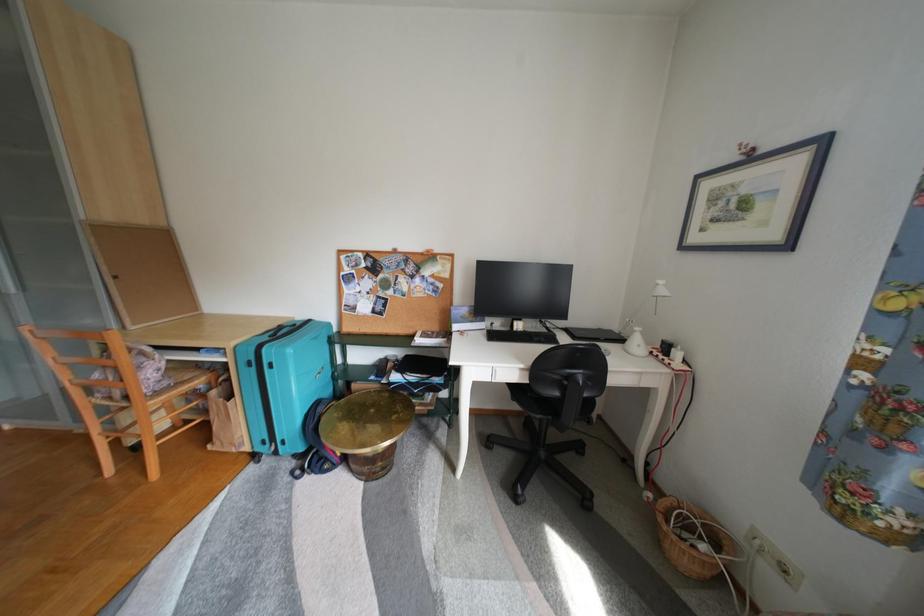
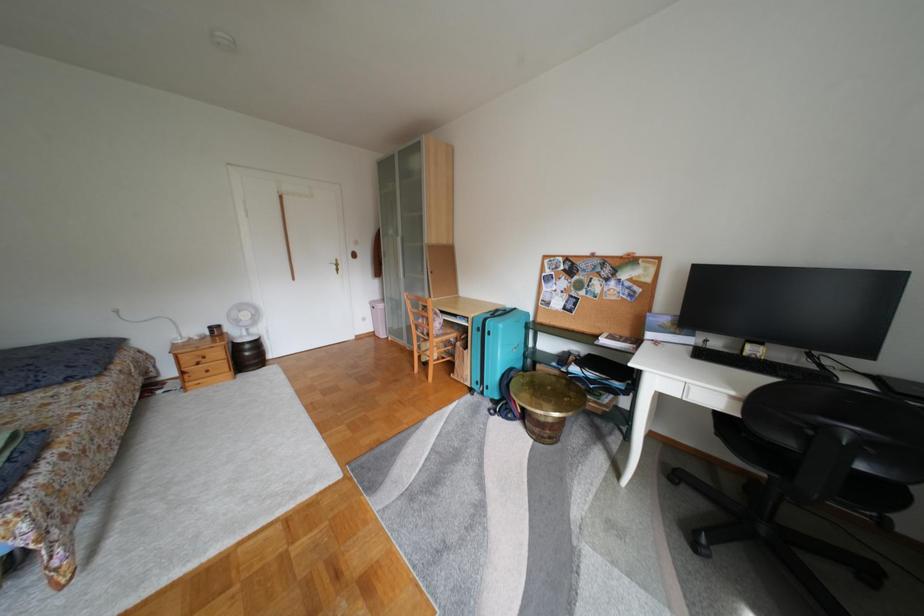
Question: The camera is either moving clockwise (left) or counter-clockwise (right) around the object. The first image is from the beginning of the video and the second image is from the end. Is the camera moving left or right when shooting the video?

Choices:
 (A) Left
 (B) Right

Answer: (B)